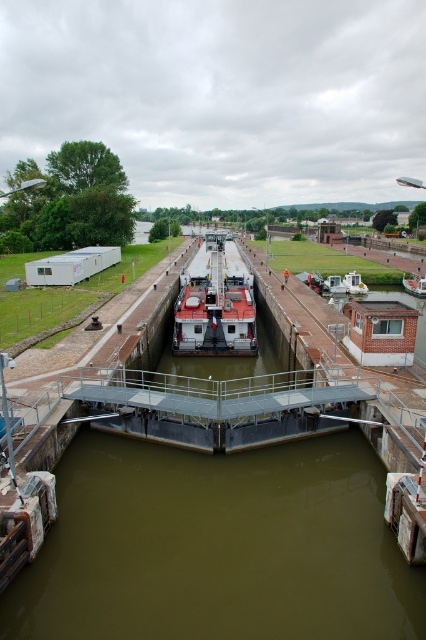
Question: Does wooden boat at center appear on the left side of white plastic boat at center?

Choices:
 (A) no
 (B) yes

Answer: (A)

Question: Is red matte boat at center thinner than white plastic boat at center?

Choices:
 (A) no
 (B) yes

Answer: (A)

Question: Does wooden boat at center lie in front of white plastic boat at center?

Choices:
 (A) yes
 (B) no

Answer: (B)

Question: Which point appears farthest from the camera in this image?

Choices:
 (A) (241, 259)
 (B) (414, 280)

Answer: (A)

Question: Which of the following is the closest to the observer?

Choices:
 (A) red matte boat at center
 (B) white plastic boat at center
 (C) wooden boat at center

Answer: (A)

Question: Which object is farther from the camera taking this photo?

Choices:
 (A) wooden boat at center
 (B) white plastic boat at center

Answer: (A)